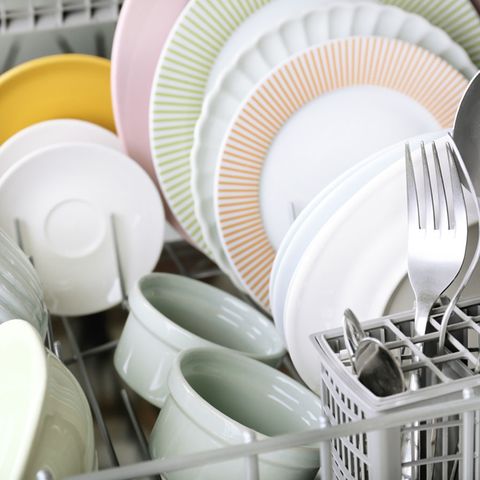
You are a GUI agent. You are given a task and a screenshot of the screen. Output one action in this format:
    pyautogui.click(x=<x>, y=<y>)
    Task: Click on the plates
    
    Given the screenshot: What is the action you would take?
    pyautogui.click(x=136, y=74), pyautogui.click(x=163, y=96), pyautogui.click(x=224, y=100), pyautogui.click(x=267, y=119), pyautogui.click(x=304, y=208), pyautogui.click(x=310, y=220), pyautogui.click(x=340, y=257), pyautogui.click(x=27, y=102), pyautogui.click(x=32, y=139), pyautogui.click(x=66, y=205)